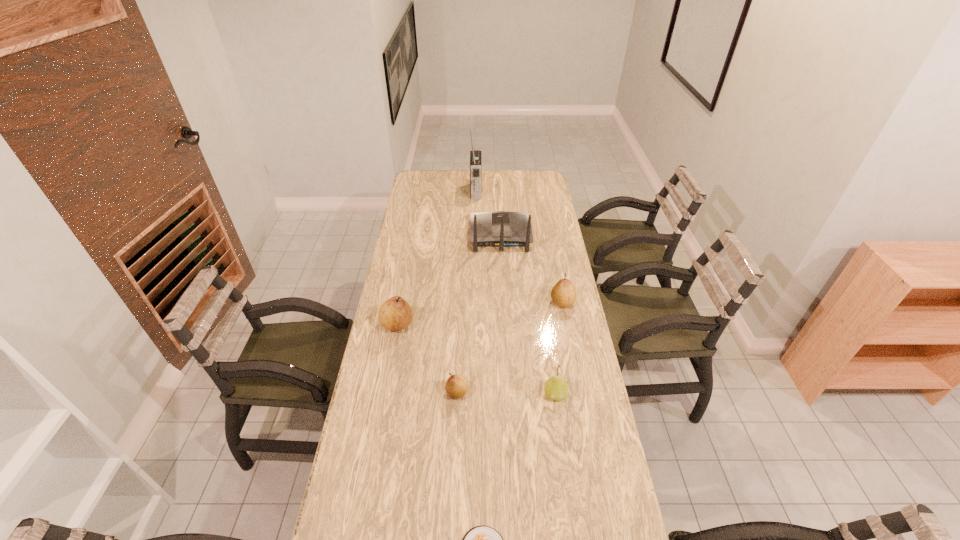
Locate an element on the screen. This screenshot has height=540, width=960. the nearest brown pear is located at coordinates (456, 386).

This screenshot has height=540, width=960. I want to click on vacant space located 0.140m on the display of the radio receiver, so click(x=508, y=191).

Identify the location of vacant space located 0.330m on the front-facing side of the second tallest object. (498, 185).

At what (x,y) coordinates should I click in order to perform the action: click on vacant area located 0.120m on the front-facing side of the second tallest object. Please return your answer as a coordinate pair (x, y). The width and height of the screenshot is (960, 540). Looking at the image, I should click on (499, 205).

The height and width of the screenshot is (540, 960). I want to click on vacant space located 0.250m on the front-facing side of the second tallest object, so click(x=498, y=192).

Locate an element on the screen. The width and height of the screenshot is (960, 540). vacant space located 0.360m on the back of the fourth nearest object is located at coordinates [x=410, y=255].

Find the location of a particular element. This screenshot has height=540, width=960. vacant point located on the front of the fifth nearest object is located at coordinates (582, 401).

Where is `free space located on the back of the green pear`? This screenshot has width=960, height=540. free space located on the back of the green pear is located at coordinates click(x=550, y=357).

Locate an element on the screen. The width and height of the screenshot is (960, 540). vacant space located on the back of the second pear from left to right is located at coordinates (459, 350).

Locate an element on the screen. This screenshot has width=960, height=540. object at the far edge is located at coordinates (475, 155).